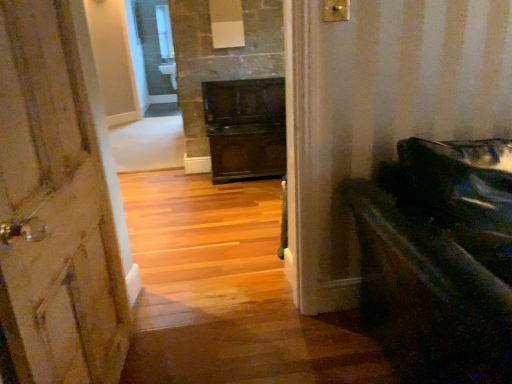
Based on the photo, measure the distance between shiny black piano at right and camera.

shiny black piano at right and camera are 33.22 inches apart from each other.

Describe the element at coordinates (439, 259) in the screenshot. I see `shiny black piano at right` at that location.

The height and width of the screenshot is (384, 512). Find the location of `shiny black piano at right`. shiny black piano at right is located at coordinates (439, 259).

What is the approximate height of shiny black piano at right?

It is 34.88 inches.

Based on the photo, what is the approximate height of wooden door at left?

It is 1.40 meters.

Image resolution: width=512 pixels, height=384 pixels. What do you see at coordinates (55, 206) in the screenshot?
I see `wooden door at left` at bounding box center [55, 206].

The width and height of the screenshot is (512, 384). What are the coordinates of `wooden door at left` in the screenshot? It's located at (55, 206).

Locate an element on the screen. This screenshot has height=384, width=512. shiny black piano at right is located at coordinates (439, 259).

Can you confirm if shiny black piano at right is positioned to the right of wooden door at left?

Yes.

Relative to wooden door at left, is shiny black piano at right in front or behind?

shiny black piano at right is positioned farther from the viewer than wooden door at left.

Looking at this image, which point is more forward, (374, 259) or (54, 343)?

The point (54, 343) is closer to the camera.

From the image's perspective, which one is positioned lower, shiny black piano at right or wooden door at left?

From the image's view, shiny black piano at right is below.

From a real-world perspective, does shiny black piano at right sit lower than wooden door at left?

Yes.

In the scene shown: Between shiny black piano at right and wooden door at left, which one has smaller width?

wooden door at left is thinner.

Based on the photo, is shiny black piano at right taller than wooden door at left?

Incorrect, the height of shiny black piano at right is not larger of that of wooden door at left.

Considering the relative sizes of shiny black piano at right and wooden door at left in the image provided, is shiny black piano at right smaller than wooden door at left?

Incorrect, shiny black piano at right is not smaller in size than wooden door at left.

Would you say wooden door at left is part of shiny black piano at right's contents?

→ No, wooden door at left is not a part of shiny black piano at right.

Is shiny black piano at right placed right next to wooden door at left?

shiny black piano at right and wooden door at left are not in contact.

Does shiny black piano at right turn towards wooden door at left?

No, shiny black piano at right does not turn towards wooden door at left.

How many degrees apart are the facing directions of shiny black piano at right and wooden door at left?

The angular difference between shiny black piano at right and wooden door at left is 85.5 degrees.

Locate an element on the screen. The image size is (512, 384). door above the shiny black piano at right (from a real-world perspective) is located at coordinates (55, 206).

Considering the relative positions of wooden door at left and shiny black piano at right in the image provided, is wooden door at left to the left of shiny black piano at right from the viewer's perspective?

Correct, you'll find wooden door at left to the left of shiny black piano at right.

Is the position of wooden door at left less distant than that of shiny black piano at right?

Yes, wooden door at left is in front of shiny black piano at right.

Considering the points (97, 346) and (405, 234), which point is behind, point (97, 346) or point (405, 234)?

The point (97, 346) is more distant.

From the image's perspective, is wooden door at left positioned above or below shiny black piano at right?

Based on their image positions, wooden door at left is located above shiny black piano at right.

From a real-world perspective, which object stands above the other?

wooden door at left is physically above.

In terms of width, does wooden door at left look wider or thinner when compared to shiny black piano at right?

Considering their sizes, wooden door at left looks slimmer than shiny black piano at right.

From the picture: Is wooden door at left taller or shorter than shiny black piano at right?

In the image, wooden door at left appears to be taller than shiny black piano at right.

From the picture: Does wooden door at left have a larger size compared to shiny black piano at right?

Actually, wooden door at left might be smaller than shiny black piano at right.

Is wooden door at left located outside shiny black piano at right?

Yes.

Is wooden door at left far from shiny black piano at right?

That's right, there is a large distance between wooden door at left and shiny black piano at right.

Is wooden door at left positioned with its back to shiny black piano at right?

That's not correct — wooden door at left is not looking away from shiny black piano at right.

What's the angular difference between wooden door at left and shiny black piano at right's facing directions?

The angle between the facing direction of wooden door at left and the facing direction of shiny black piano at right is 85.5 degrees.

The width and height of the screenshot is (512, 384). In order to click on door above the shiny black piano at right (from the image's perspective) in this screenshot , I will do `click(55, 206)`.

Find the location of `door above the shiny black piano at right (from the image's perspective)`. door above the shiny black piano at right (from the image's perspective) is located at coordinates (55, 206).

What are the coordinates of `door that is on the left side of shiny black piano at right` in the screenshot? It's located at (55, 206).